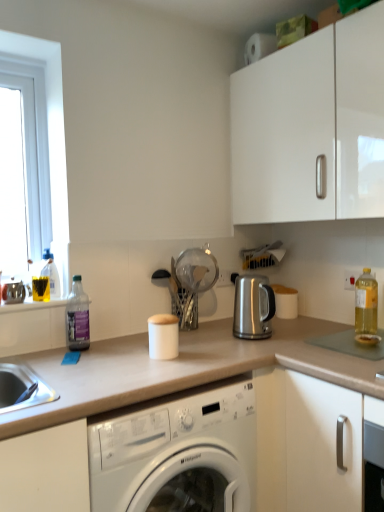
The height and width of the screenshot is (512, 384). What do you see at coordinates (193, 281) in the screenshot? I see `transparent glass strainer at center, the 2th appliance viewed from the right` at bounding box center [193, 281].

Where is `translucent yellow bottle at right, placed as the third bottle when sorted from left to right`? translucent yellow bottle at right, placed as the third bottle when sorted from left to right is located at coordinates (366, 303).

At what (x,y) coordinates should I click in order to perform the action: click on white glossy cabinet at upper right. Please return your answer as a coordinate pair (x, y). This screenshot has height=512, width=384. Looking at the image, I should click on (312, 126).

This screenshot has width=384, height=512. Describe the element at coordinates (51, 273) in the screenshot. I see `translucent plastic bottle at left, acting as the third bottle starting from the right` at that location.

You are a GUI agent. You are given a task and a screenshot of the screen. Output one action in this format:
    pyautogui.click(x=<x>, y=<y>)
    Task: Click on the translucent plastic bottle at left, placed as the 1th bottle when sorted from left to right
    Image resolution: width=384 pixels, height=512 pixels.
    Given the screenshot: What is the action you would take?
    pyautogui.click(x=51, y=273)

This screenshot has width=384, height=512. What are the coordinates of `beige laminate countertop at center` in the screenshot? It's located at (146, 396).

What do you see at coordinates (253, 307) in the screenshot? The height and width of the screenshot is (512, 384). I see `satin silver kettle at center, the third appliance in the left-to-right sequence` at bounding box center [253, 307].

Find the location of a particular element. Image resolution: width=384 pixels, height=512 pixels. satin silver kettle at center, the third appliance in the left-to-right sequence is located at coordinates (253, 307).

This screenshot has width=384, height=512. What are the coordinates of `white matte canister at center, marked as the first appliance in a left-to-right arrangement` in the screenshot? It's located at (163, 336).

Based on the photo, is transparent glass strainer at center, the 2th appliance viewed from the right, touching translucent yellow bottle at right, which appears as the first bottle when viewed from the right?

No, transparent glass strainer at center, the 2th appliance viewed from the right, is not in contact with translucent yellow bottle at right, which appears as the first bottle when viewed from the right.

Is transparent glass strainer at center, the 2th appliance viewed from the right, to the left or to the right of translucent yellow bottle at right, placed as the third bottle when sorted from left to right, in the image?

From the image, it's evident that transparent glass strainer at center, the 2th appliance viewed from the right, is to the left of translucent yellow bottle at right, placed as the third bottle when sorted from left to right.

Looking at the image, does transparent glass strainer at center, the 2th appliance viewed from the right, seem bigger or smaller compared to translucent yellow bottle at right, which appears as the first bottle when viewed from the right?

Considering their sizes, transparent glass strainer at center, the 2th appliance viewed from the right, takes up more space than translucent yellow bottle at right, which appears as the first bottle when viewed from the right.

Considering the positions of point (218, 284) and point (36, 278), is point (218, 284) closer or farther from the camera than point (36, 278)?

Clearly, point (218, 284) is more distant from the camera than point (36, 278).

Is satin silver outlet at center to the right of translucent yellow liquid at window left from the viewer's perspective?

Indeed, satin silver outlet at center is positioned on the right side of translucent yellow liquid at window left.

Is satin silver outlet at center bigger than translucent yellow liquid at window left?

No.

Is satin silver outlet at center placed right next to translucent yellow liquid at window left?

satin silver outlet at center is not next to translucent yellow liquid at window left, and they're not touching.

This screenshot has width=384, height=512. Identify the location of countertop below the transparent glass strainer at center, the 2th appliance viewed from the right (from a real-world perspective). (146, 396).

Based on the photo, how many degrees apart are the facing directions of transparent glass strainer at center, the 2th appliance viewed from the right, and beige laminate countertop at center?

The angular difference between transparent glass strainer at center, the 2th appliance viewed from the right, and beige laminate countertop at center is 2.08 degrees.

From a real-world perspective, which is physically above, transparent glass strainer at center, the second appliance when ordered from left to right, or beige laminate countertop at center?

transparent glass strainer at center, the second appliance when ordered from left to right, from a real-world perspective.

Does transparent glass strainer at center, the 2th appliance viewed from the right, appear on the left side of beige laminate countertop at center?

Yes.

In terms of width, does clear plastic bottle at left, which ranks as the 2th bottle in left-to-right order, look wider or thinner when compared to transparent glass strainer at center, the second appliance when ordered from left to right?

Considering their sizes, clear plastic bottle at left, which ranks as the 2th bottle in left-to-right order, looks slimmer than transparent glass strainer at center, the second appliance when ordered from left to right.

Which of these two, clear plastic bottle at left, the 2th bottle in the right-to-left sequence, or transparent glass strainer at center, the 2th appliance viewed from the right, is smaller?

A: clear plastic bottle at left, the 2th bottle in the right-to-left sequence.

Would you say clear plastic bottle at left, the 2th bottle in the right-to-left sequence, is to the left or to the right of transparent glass strainer at center, the second appliance when ordered from left to right, in the picture?

Based on their positions, clear plastic bottle at left, the 2th bottle in the right-to-left sequence, is located to the left of transparent glass strainer at center, the second appliance when ordered from left to right.

Between white glossy washing machine at center and white glossy cabinet at upper right, which one has more height?

Standing taller between the two is white glossy washing machine at center.

Would you say white glossy cabinet at upper right is part of white glossy washing machine at center's contents?

No.

I want to click on washing machine below the white glossy cabinet at upper right (from a real-world perspective), so click(178, 453).

Is white glossy washing machine at center to the left of white glossy cabinet at upper right from the viewer's perspective?

Correct, you'll find white glossy washing machine at center to the left of white glossy cabinet at upper right.

Looking at the image, does white glossy washing machine at center seem bigger or smaller compared to transparent glass strainer at center, the second appliance when ordered from left to right?

Clearly, white glossy washing machine at center is larger in size than transparent glass strainer at center, the second appliance when ordered from left to right.

Image resolution: width=384 pixels, height=512 pixels. I want to click on washing machine in front of the transparent glass strainer at center, the second appliance when ordered from left to right, so click(x=178, y=453).

Is point (239, 492) more distant than point (183, 306)?

No, (239, 492) is in front of (183, 306).

Measure the distance between translucent plastic bottle at left, acting as the third bottle starting from the right, and beige laminate countertop at center.

They are 25.82 inches apart.

From the image's perspective, which one is positioned higher, translucent plastic bottle at left, acting as the third bottle starting from the right, or beige laminate countertop at center?

translucent plastic bottle at left, acting as the third bottle starting from the right, from the image's perspective.

Considering the sizes of objects translucent plastic bottle at left, acting as the third bottle starting from the right, and beige laminate countertop at center in the image provided, who is shorter, translucent plastic bottle at left, acting as the third bottle starting from the right, or beige laminate countertop at center?

translucent plastic bottle at left, acting as the third bottle starting from the right, is shorter.

Is translucent plastic bottle at left, acting as the third bottle starting from the right, oriented away from beige laminate countertop at center?

No, translucent plastic bottle at left, acting as the third bottle starting from the right,'s orientation is not away from beige laminate countertop at center.

This screenshot has height=512, width=384. I want to click on appliance above the translucent yellow bottle at right, placed as the third bottle when sorted from left to right (from a real-world perspective), so click(193, 281).

At what (x,y) coordinates should I click in order to perform the action: click on beverage in front of the satin silver outlet at center. Please return your answer as a coordinate pair (x, y). The height and width of the screenshot is (512, 384). Looking at the image, I should click on (41, 288).

From the image, which object appears to be farther from satin silver outlet at center, translucent yellow liquid at window left or clear plastic bottle at left, the 2th bottle in the right-to-left sequence?

Among the two, translucent yellow liquid at window left is located further to satin silver outlet at center.

Which object lies further to the anchor point white glossy cabinet at upper right, translucent plastic bottle at left, placed as the 1th bottle when sorted from left to right, or transparent glass strainer at center, the 2th appliance viewed from the right?

translucent plastic bottle at left, placed as the 1th bottle when sorted from left to right, is further to white glossy cabinet at upper right.

From the image, which object appears to be nearer to clear plastic bottle at left, which ranks as the 2th bottle in left-to-right order, white glossy cabinet at upper right or translucent yellow liquid at window left?

Based on the image, translucent yellow liquid at window left appears to be nearer to clear plastic bottle at left, which ranks as the 2th bottle in left-to-right order.

Based on their spatial positions, is white glossy cabinet at upper right or white glossy washing machine at center closer to translucent yellow bottle at right, placed as the third bottle when sorted from left to right?

Based on the image, white glossy cabinet at upper right appears to be nearer to translucent yellow bottle at right, placed as the third bottle when sorted from left to right.

Based on their spatial positions, is clear plastic bottle at left, the 2th bottle in the right-to-left sequence, or satin silver kettle at center, the third appliance in the left-to-right sequence, closer to translucent yellow liquid at window left?

clear plastic bottle at left, the 2th bottle in the right-to-left sequence, is positioned closer to the anchor translucent yellow liquid at window left.

From the picture: Based on their spatial positions, is satin silver outlet at center or translucent plastic bottle at left, placed as the 1th bottle when sorted from left to right, further from translucent yellow liquid at window left?

satin silver outlet at center is further to translucent yellow liquid at window left.

Which object lies further to the anchor point translucent plastic bottle at left, placed as the 1th bottle when sorted from left to right, translucent yellow bottle at right, placed as the third bottle when sorted from left to right, or translucent yellow liquid at window left?

translucent yellow bottle at right, placed as the third bottle when sorted from left to right, is further to translucent plastic bottle at left, placed as the 1th bottle when sorted from left to right.

Which object lies nearer to the anchor point translucent yellow liquid at window left, transparent glass strainer at center, the second appliance when ordered from left to right, or translucent plastic bottle at left, acting as the third bottle starting from the right?

translucent plastic bottle at left, acting as the third bottle starting from the right, lies closer to translucent yellow liquid at window left than the other object.

Where is `appliance that lies between white glossy cabinet at upper right and satin silver kettle at center, placed as the 1th appliance when sorted from right to left, from top to bottom`? The width and height of the screenshot is (384, 512). appliance that lies between white glossy cabinet at upper right and satin silver kettle at center, placed as the 1th appliance when sorted from right to left, from top to bottom is located at coordinates (193, 281).

Identify the location of washing machine between translucent yellow liquid at window left and translucent yellow bottle at right, which appears as the first bottle when viewed from the right. This screenshot has width=384, height=512. (178, 453).

Find the location of a particular element. The height and width of the screenshot is (512, 384). countertop between white matte canister at center, the 3th appliance positioned from the right, and translucent yellow bottle at right, which appears as the first bottle when viewed from the right is located at coordinates (146, 396).

Find the location of `bottle located between translucent plastic bottle at left, acting as the third bottle starting from the right, and white matte canister at center, the 3th appliance positioned from the right, in the left-right direction`. bottle located between translucent plastic bottle at left, acting as the third bottle starting from the right, and white matte canister at center, the 3th appliance positioned from the right, in the left-right direction is located at coordinates (77, 317).